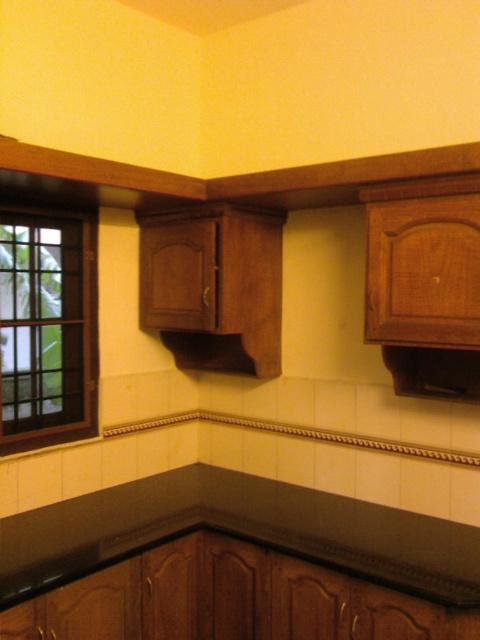
You are a chef preparing to place a large pot on the counter. The pot is too heavy to lift, so you need to slide it from the brown wooden window at left to the black laminate counter top at upper center. Is this possible given their positions?

The black laminate counter top at upper center is to the right of the brown wooden window at left, so yes, you can slide the pot from the brown wooden window at left to the black laminate counter top at upper center since they are positioned horizontally adjacent to each other.

You are a kitchen designer planning to place a rectangular cutting board on the black laminate counter top at upper center. The cutting board is 1.2 meters long. Can you confirm if the counter top is wide enough to accommodate the cutting board without overhanging the edge near the brown wooden window at left?

The black laminate counter top at upper center has a larger width than the brown wooden window at left. Since the cutting board is 1.2 meters long, and the counter top is wider than the window, it should be able to accommodate the cutting board without overhanging near the window.

You are a chef preparing to place a large cutting board on the black laminate counter top at upper center. The board requires at least 80 centimeters of space to avoid the brown wooden window at left. Can you fit it there?

The black laminate counter top at upper center is only 79.04 centimeters away from the brown wooden window at left, which is less than the required 80 centimeters. Therefore, the cutting board cannot be placed there without overlapping the window.